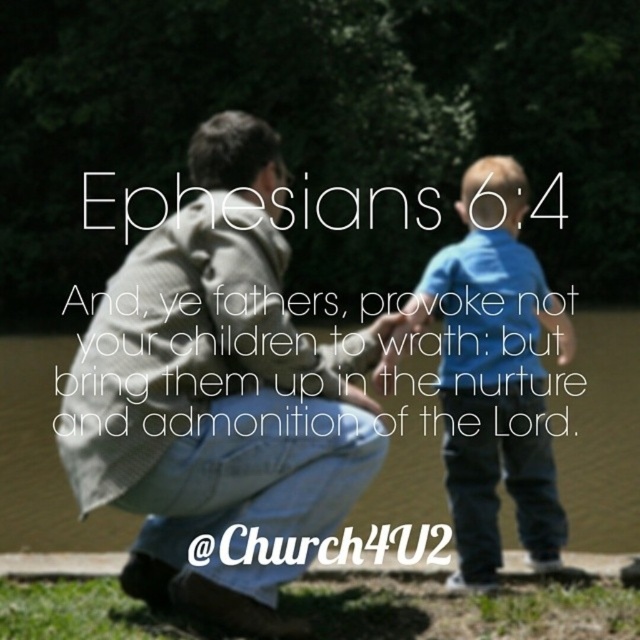
Question: Is light blue denim jeans at center further to camera compared to blue cotton shirt at center?

Choices:
 (A) yes
 (B) no

Answer: (B)

Question: Which object is the closest to the blue cotton shirt at center?

Choices:
 (A) clear water at lower left
 (B) light blue denim jeans at center

Answer: (B)

Question: From the image, what is the correct spatial relationship of clear water at lower left in relation to blue cotton shirt at center?

Choices:
 (A) below
 (B) above

Answer: (A)

Question: Can you confirm if light blue denim jeans at center is positioned to the right of blue cotton shirt at center?

Choices:
 (A) yes
 (B) no

Answer: (B)

Question: Among these points, which one is farthest from the camera?

Choices:
 (A) (419, 371)
 (B) (202, 605)

Answer: (A)

Question: Which of these objects is positioned farthest from the light blue denim jeans at center?

Choices:
 (A) blue cotton shirt at center
 (B) clear water at lower left

Answer: (B)